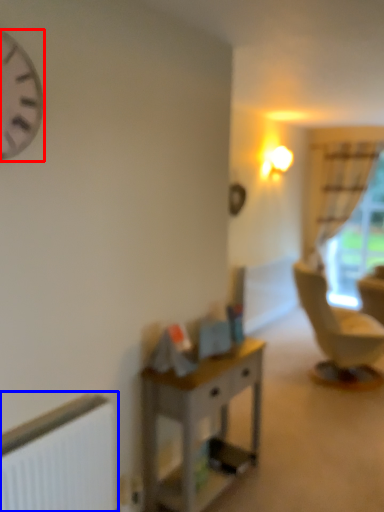
Question: Which object appears farthest to the camera in this image, clock (highlighted by a red box) or radiator (highlighted by a blue box)?

Choices:
 (A) clock
 (B) radiator

Answer: (B)